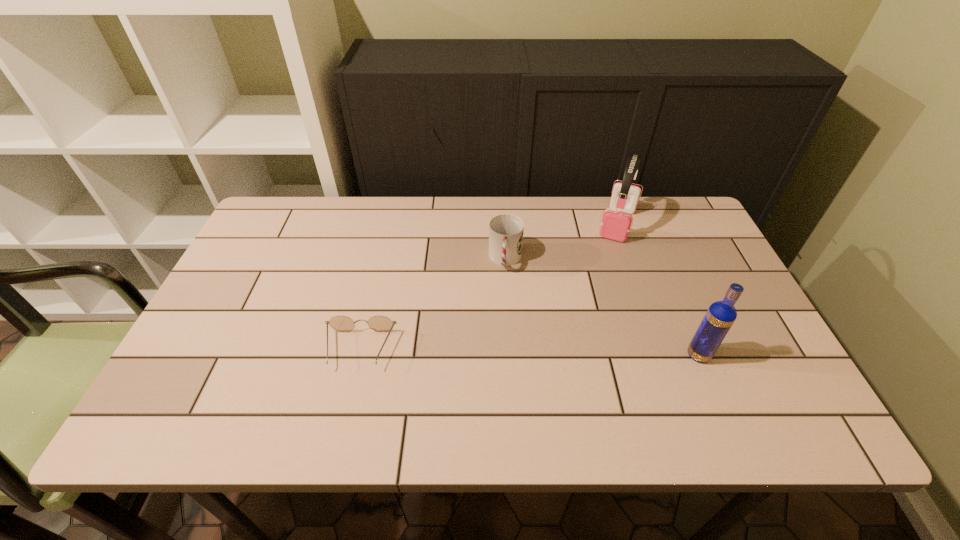
At what (x,y) coordinates should I click in order to perform the action: click on free point located 0.360m on the outer surface of the earphone. Please return your answer as a coordinate pair (x, y). The image size is (960, 540). Looking at the image, I should click on (585, 332).

This screenshot has width=960, height=540. Find the location of `blank space located on the outer surface of the earphone`. blank space located on the outer surface of the earphone is located at coordinates (609, 259).

Locate an element on the screen. free space located 0.390m on the outer surface of the earphone is located at coordinates (581, 341).

Where is `cup located in the far edge section of the desktop`? cup located in the far edge section of the desktop is located at coordinates (x=506, y=231).

You are a GUI agent. You are given a task and a screenshot of the screen. Output one action in this format:
    pyautogui.click(x=<x>, y=<y>)
    Task: Click on the earphone located in the far edge section of the desktop
    The width and height of the screenshot is (960, 540).
    Given the screenshot: What is the action you would take?
    pyautogui.click(x=616, y=222)

Where is `spectacles that is positioned at the near edge`? The width and height of the screenshot is (960, 540). spectacles that is positioned at the near edge is located at coordinates (378, 323).

Locate an element on the screen. Image resolution: width=960 pixels, height=540 pixels. vodka that is at the near edge is located at coordinates (720, 316).

This screenshot has width=960, height=540. I want to click on object located at the right edge, so click(x=720, y=316).

Find the location of a particular element. object that is at the near right corner is located at coordinates (720, 316).

Where is `vacant area at the far edge of the desktop`? vacant area at the far edge of the desktop is located at coordinates (409, 231).